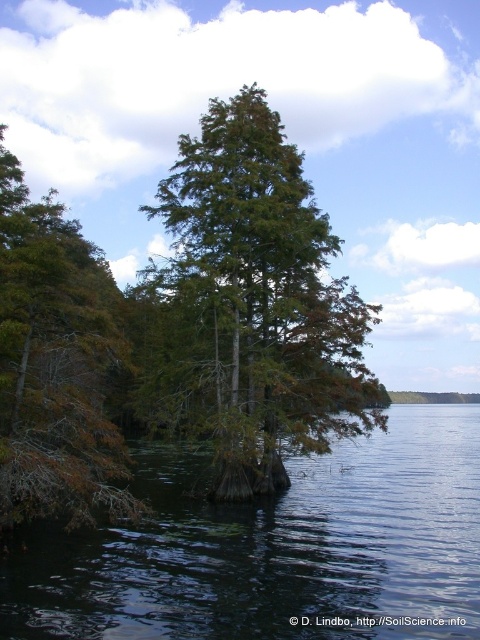
Question: Where is green matte tree at center located in relation to brown matte tree at left in the image?

Choices:
 (A) below
 (B) above

Answer: (A)

Question: Considering the real-world distances, which object is closest to the brown matte tree at left?

Choices:
 (A) green matte tree at center
 (B) dark green water at lower left

Answer: (A)

Question: Is dark green water at lower left wider than brown matte tree at left?

Choices:
 (A) no
 (B) yes

Answer: (B)

Question: Based on their relative distances, which object is nearer to the green matte tree at center?

Choices:
 (A) brown matte tree at left
 (B) dark green water at lower left

Answer: (A)

Question: Is dark green water at lower left bigger than green matte tree at center?

Choices:
 (A) yes
 (B) no

Answer: (A)

Question: Estimate the real-world distances between objects in this image. Which object is closer to the dark green water at lower left?

Choices:
 (A) green matte tree at center
 (B) brown matte tree at left

Answer: (A)